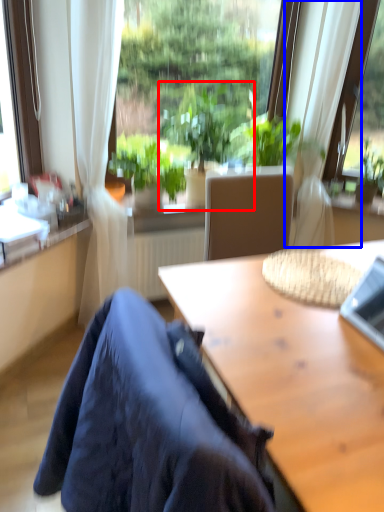
Question: Among these objects, which one is nearest to the camera, houseplant (highlighted by a red box) or curtain (highlighted by a blue box)?

Choices:
 (A) houseplant
 (B) curtain

Answer: (B)